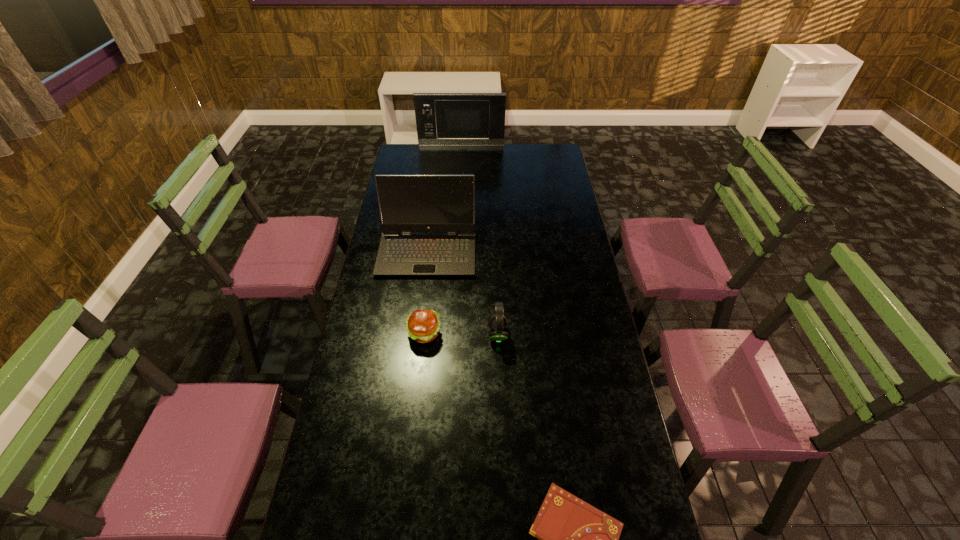
The image size is (960, 540). Identify the location of microwave oven. (441, 118).

The height and width of the screenshot is (540, 960). Identify the location of laptop computer. (408, 203).

This screenshot has width=960, height=540. In order to click on headset in this screenshot , I will do `click(498, 322)`.

At what (x,y) coordinates should I click in order to perform the action: click on hamburger. Please return your answer as a coordinate pair (x, y). This screenshot has width=960, height=540. Looking at the image, I should click on [422, 325].

What are the coordinates of `vacant space located 0.120m on the front panel of the farthest object` in the screenshot? It's located at (461, 157).

Find the location of a particular element. Image resolution: width=960 pixels, height=540 pixels. vacant space situated on the screen of the fourth nearest object is located at coordinates (417, 336).

Locate an element on the screen. free location located 0.130m on the ear cups of the third tallest object is located at coordinates (452, 334).

Image resolution: width=960 pixels, height=540 pixels. I want to click on vacant area situated on the ear cups of the third tallest object, so click(452, 334).

Find the location of a particular element. vacant point located 0.260m on the ear cups of the third tallest object is located at coordinates (416, 334).

Find the location of a particular element. vacant region located 0.200m on the right of the fourth tallest object is located at coordinates (497, 334).